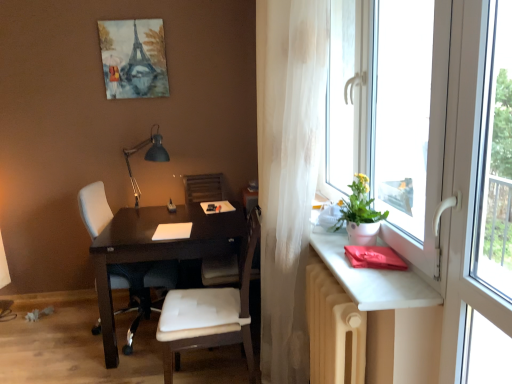
Where is `free space above matte white table at right (from a real-world perspective)`? This screenshot has width=512, height=384. free space above matte white table at right (from a real-world perspective) is located at coordinates (353, 260).